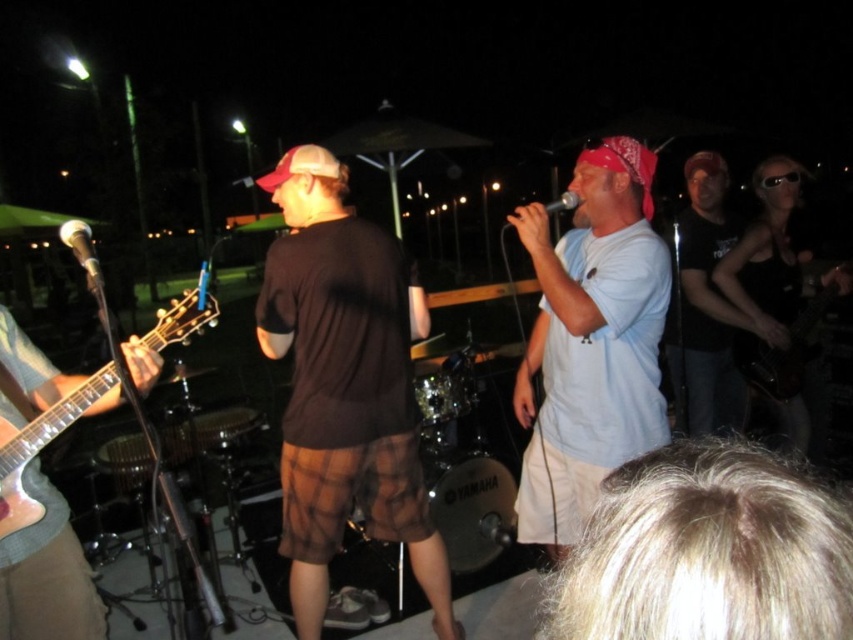
Question: Among these objects, which one is nearest to the camera?

Choices:
 (A) light blue t-shirt at center
 (B) matte black microphone at center
 (C) brown plaid shorts at center
 (D) white matte microphone at left

Answer: (D)

Question: Which point is closer to the camera?

Choices:
 (A) metallic silver guitar at left
 (B) white matte microphone at left

Answer: (B)

Question: Can you confirm if brown plaid shorts at center is positioned to the right of white matte microphone at left?

Choices:
 (A) yes
 (B) no

Answer: (A)

Question: Is brown plaid shorts at center to the left of matte black microphone at center from the viewer's perspective?

Choices:
 (A) yes
 (B) no

Answer: (A)

Question: Which object is the closest to the matte black microphone at center?

Choices:
 (A) brown plaid shorts at center
 (B) metallic silver guitar at left
 (C) light blue t-shirt at center

Answer: (C)

Question: Is brown plaid shorts at center thinner than metallic silver guitar at left?

Choices:
 (A) no
 (B) yes

Answer: (A)